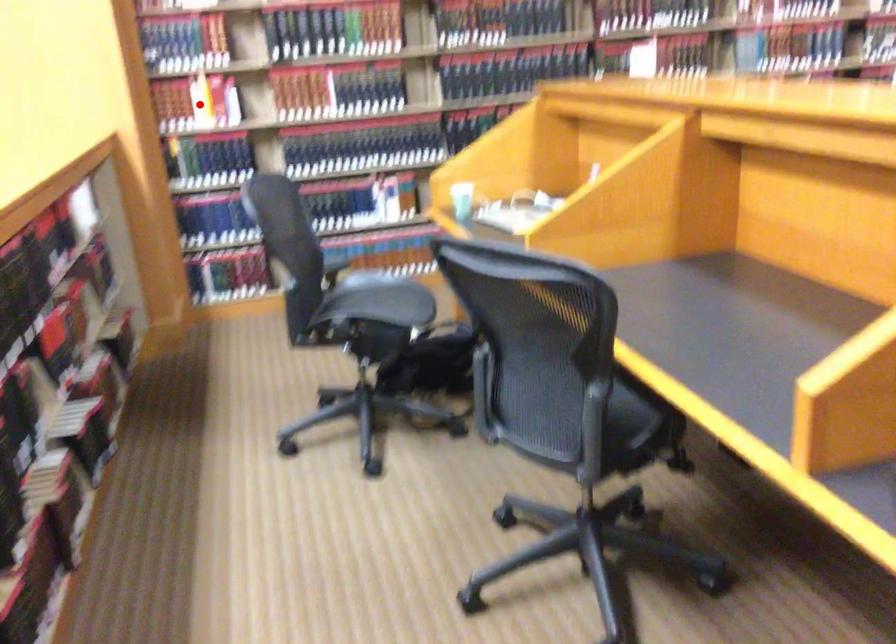
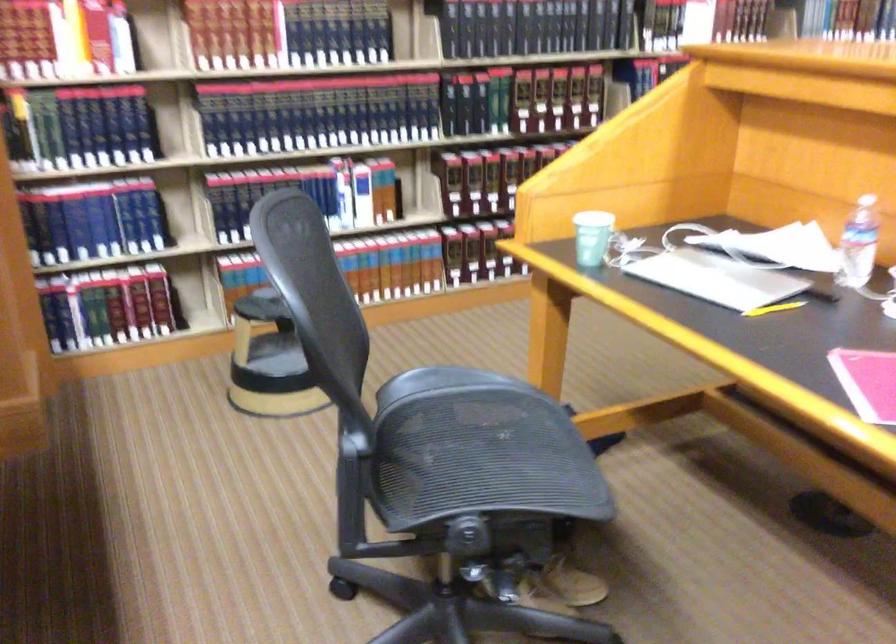
Question: I am providing you with two images of the same scene from different viewpoints. Image1 has a red point marked. In image2, the corresponding 3D location appears at what relative position? Reply with the corresponding letter.

Choices:
 (A) Closer
 (B) Farther

Answer: (A)